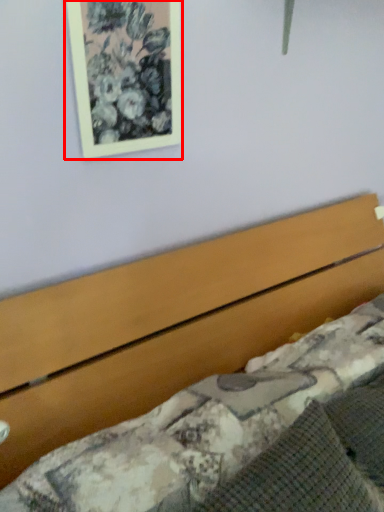
Question: Considering the relative positions of picture frame (annotated by the red box) and bed in the image provided, where is picture frame (annotated by the red box) located with respect to the staircase?

Choices:
 (A) right
 (B) left

Answer: (B)